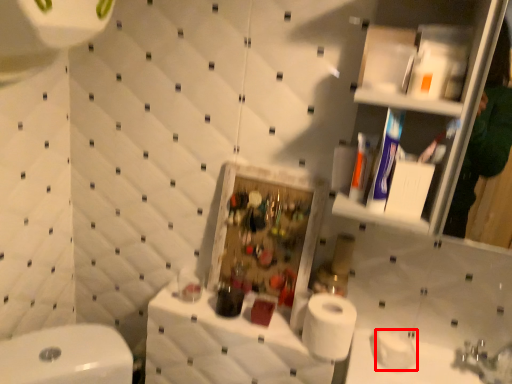
Question: From the image's perspective, what is the correct spatial relationship of toilet paper (annotated by the red box) in relation to counter top?

Choices:
 (A) below
 (B) above

Answer: (B)